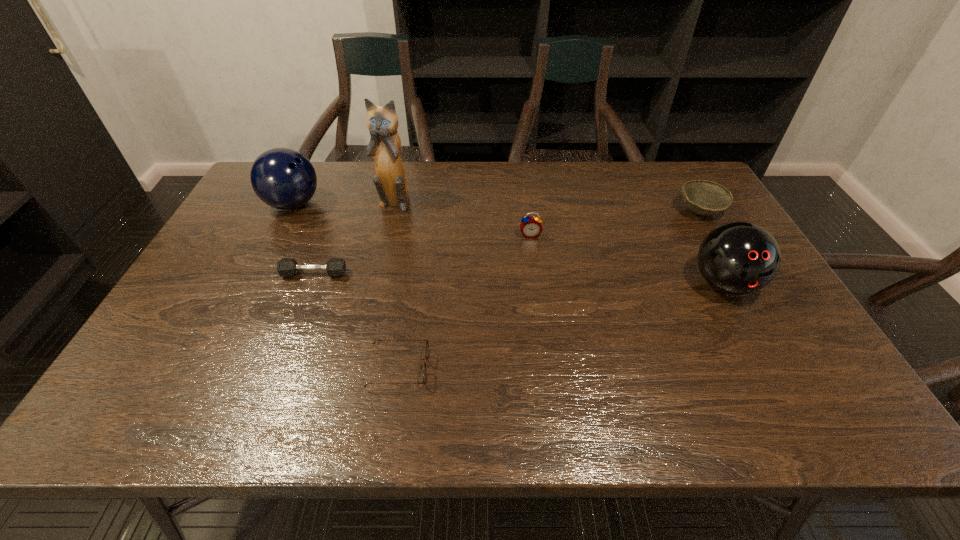
Find the location of a particular element. object that is the third closest to the bowl is located at coordinates (390, 181).

Identify which object is the fifth closest to the left bowling ball. Please provide its 2D coordinates. Your answer should be formatted as a tuple, i.e. [(x, y)], where the tuple contains the x and y coordinates of a point satisfying the conditions above.

[(738, 258)]

What are the coordinates of `vacant space that satisfies the following two spatial constraints: 1. on the front-facing side of the alarm clock; 2. on the front-facing side of the shortest object` in the screenshot? It's located at tap(547, 368).

Where is `blank space that satisfies the following two spatial constraints: 1. on the surface of the left bowling ball near the finger holes; 2. on the back side of the dumbbell`? blank space that satisfies the following two spatial constraints: 1. on the surface of the left bowling ball near the finger holes; 2. on the back side of the dumbbell is located at coordinates (258, 274).

This screenshot has height=540, width=960. I want to click on vacant area in the image that satisfies the following two spatial constraints: 1. on the surface of the farther bowling ball near the finger holes; 2. on the back side of the third shortest object, so click(x=290, y=211).